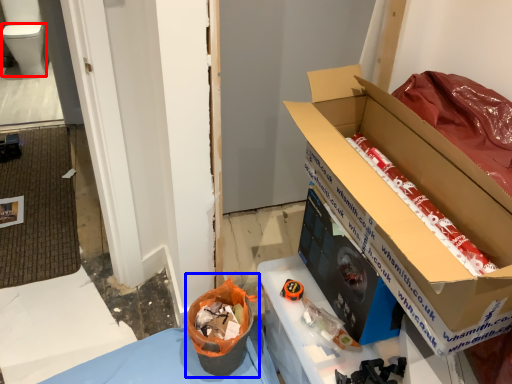
Question: Which point is closer to the camera, toilet bowl (highlighted by a red box) or recycling bin (highlighted by a blue box)?

Choices:
 (A) toilet bowl
 (B) recycling bin

Answer: (B)